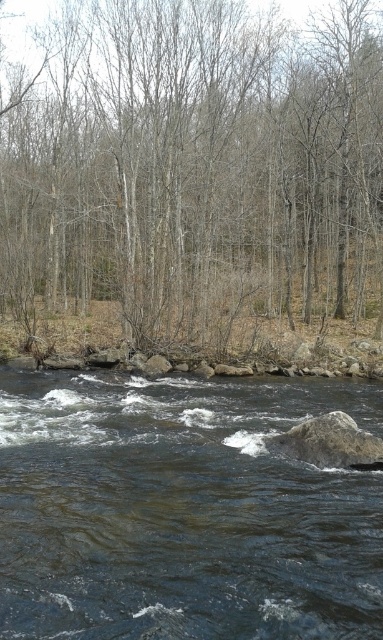
Question: Is brown/dry wood trees at center bigger than dark brown water at center?

Choices:
 (A) no
 (B) yes

Answer: (B)

Question: Observing the image, what is the correct spatial positioning of dark brown water at center in reference to gray rough rock at center?

Choices:
 (A) left
 (B) right

Answer: (A)

Question: Which of the following is the farthest from the observer?

Choices:
 (A) gray rough rock at center
 (B) dark brown water at center

Answer: (A)

Question: Which point is closer to the camera taking this photo?

Choices:
 (A) (266, 68)
 (B) (304, 442)

Answer: (B)

Question: Is brown/dry wood trees at center thinner than gray rough rock at center?

Choices:
 (A) no
 (B) yes

Answer: (A)

Question: Based on their relative distances, which object is farther from the dark brown water at center?

Choices:
 (A) brown/dry wood trees at center
 (B) gray rough rock at center

Answer: (A)